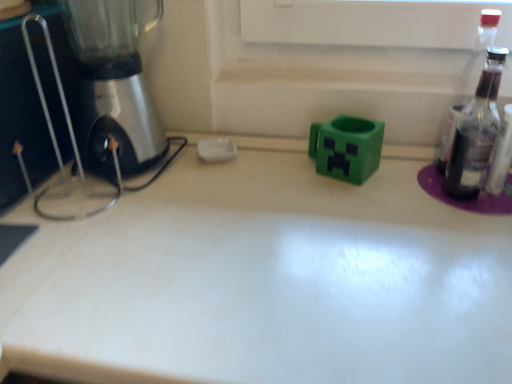
In order to click on vacant region to the left of transparent glass bottle at right in this screenshot , I will do (372, 196).